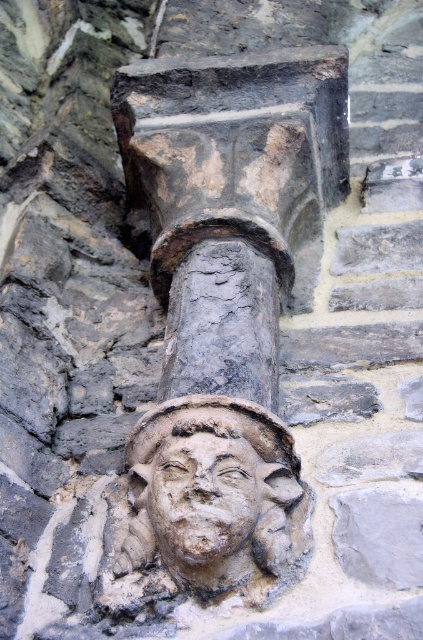
Question: Does dark gray stone pillar at center come in front of stone carved face at center?

Choices:
 (A) yes
 (B) no

Answer: (B)

Question: Is dark gray stone pillar at center above stone carved face at center?

Choices:
 (A) yes
 (B) no

Answer: (A)

Question: Is dark gray stone pillar at center to the right of stone carved face at center from the viewer's perspective?

Choices:
 (A) yes
 (B) no

Answer: (A)

Question: Which point is farther to the camera?

Choices:
 (A) (195, 163)
 (B) (211, 524)

Answer: (A)

Question: Which point appears farthest from the camera in this image?

Choices:
 (A) (203, 506)
 (B) (335, 182)

Answer: (B)